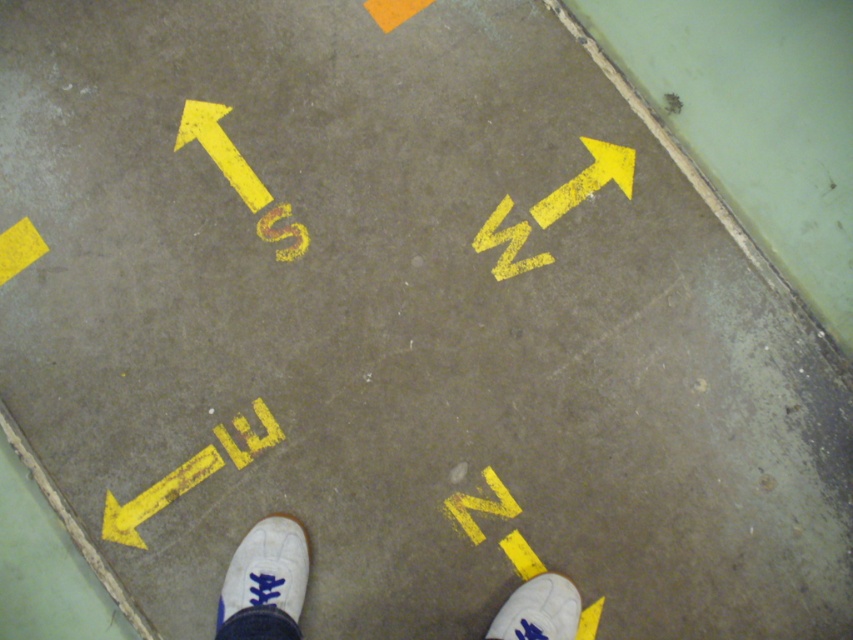
You are standing on the concrete floor with directional arrows and need to place both the white canvas shoe at center and the white suede shoe at lower right into a storage box that can only hold items within a 15 inch radius. Will both shoes fit inside the box?

The white canvas shoe at center and white suede shoe at lower right are 15.34 inches apart. Since the storage box has a 15 inch radius, the distance between them exceeds the maximum allowable space, so they cannot both fit inside the box.

You are navigating a delivery robot in a parking garage. Your current position is at point (532,620). You need to move to point (567,604). According to the directional arrows on the floor, which direction should you head? The cardinal directions are marked as N, S, E, W. Please provide your answer as a single letter.

The point (567,604) is behind point (532,620). Since the robot is at point (532,620), it should move in the direction opposite to where the arrows point to reach the target point. However, without specific arrow directions, we can infer based on coordinates. Since the target point has a lower x and higher y coordinate, moving West or North would be appropriate. But according to the description, the point is behind, so if facing North, moving South might be correct. However, the exact direction can

Consider the image. You are standing on the concrete floor marked with yellow directional arrows and letters. You notice a white canvas shoe at center and a white suede shoe at lower left. If you want to pick up both shoes, which one is closer to your current position?

The white canvas shoe at center is closer to your current position because it is only 0.24 inches away from the white suede shoe at lower left. Since you are standing on the concrete floor, the distance between them is very small, so whichever shoe is closer depends on your exact location. However, based on the given information, the white canvas shoe at center is positioned closer to the white suede shoe at lower left by 0.24 inches, but without knowing your exact position, we can infer that if you are equ